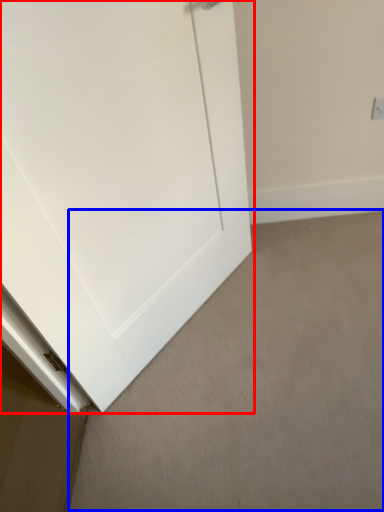
Question: Which object appears closest to the camera in this image, door (highlighted by a red box) or plain (highlighted by a blue box)?

Choices:
 (A) door
 (B) plain

Answer: (A)